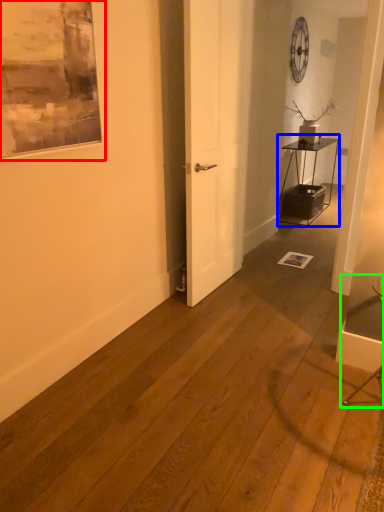
Question: Considering the real-world distances, which object is closest to picture frame (highlighted by a red box)? table (highlighted by a blue box) or armchair (highlighted by a green box).

Choices:
 (A) table
 (B) armchair

Answer: (B)